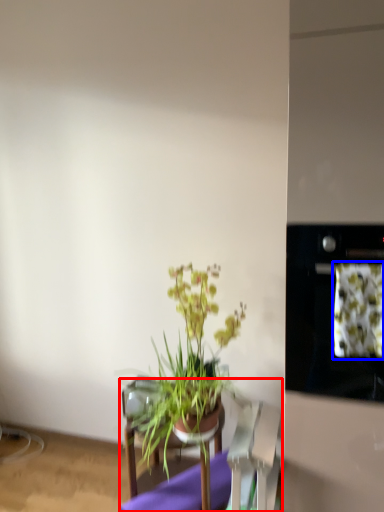
Question: Which object appears farthest to the camera in this image, furniture (highlighted by a red box) or flower (highlighted by a blue box)?

Choices:
 (A) furniture
 (B) flower

Answer: (A)